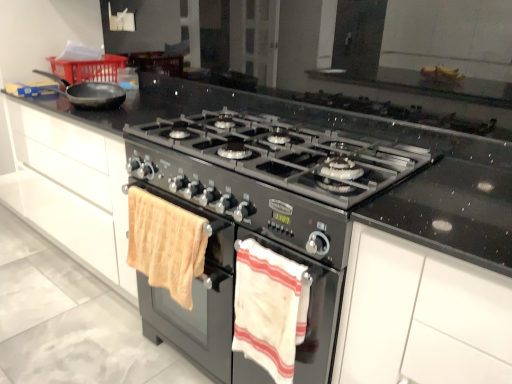
Measure the distance between point (337, 197) and camera.

Point (337, 197) is 3.30 feet from camera.

This screenshot has width=512, height=384. I want to click on black matte gas stove at center, so click(290, 154).

At what (x,y) coordinates should I click in order to perform the action: click on black matte gas stove at center. Please return your answer as a coordinate pair (x, y). Looking at the image, I should click on (290, 154).

Does beige cotton towel at lower left, positioned as the second beach towel in right-to-left order, contain white striped towel at lower center, the 2th beach towel when ordered from left to right?

No, beige cotton towel at lower left, positioned as the second beach towel in right-to-left order, does not contain white striped towel at lower center, the 2th beach towel when ordered from left to right.

Does beige cotton towel at lower left, marked as the 1th beach towel in a left-to-right arrangement, lie in front of white striped towel at lower center, the first beach towel when ordered from right to left?

No.

Can you confirm if beige cotton towel at lower left, positioned as the second beach towel in right-to-left order, is wider than white striped towel at lower center, the first beach towel when ordered from right to left?

Indeed, beige cotton towel at lower left, positioned as the second beach towel in right-to-left order, has a greater width compared to white striped towel at lower center, the first beach towel when ordered from right to left.

You are a GUI agent. You are given a task and a screenshot of the screen. Output one action in this format:
    pyautogui.click(x=<x>, y=<y>)
    Task: Click on the beach towel lying behind the white striped towel at lower center, the first beach towel when ordered from right to left
    
    Given the screenshot: What is the action you would take?
    pyautogui.click(x=165, y=244)

Which object is further away from the camera, black matte frying pan at upper left or white matte cabinet at upper right?

black matte frying pan at upper left is more distant.

Looking at their sizes, would you say black matte frying pan at upper left is wider or thinner than white matte cabinet at upper right?

In the image, black matte frying pan at upper left appears to be more narrow than white matte cabinet at upper right.

From the image's perspective, is black matte frying pan at upper left positioned above or below white matte cabinet at upper right?

From the image's perspective, black matte frying pan at upper left appears above white matte cabinet at upper right.

Identify the location of frying pan on the left of white matte cabinet at upper right. (90, 93).

Which is behind, point (101, 99) or point (290, 275)?

The point (101, 99) is more distant.

Is black matte frying pan at upper left in front of or behind white striped towel at lower center, the 2th beach towel when ordered from left to right, in the image?

Visually, black matte frying pan at upper left is located behind white striped towel at lower center, the 2th beach towel when ordered from left to right.

The width and height of the screenshot is (512, 384). What are the coordinates of `frying pan that is above the white striped towel at lower center, the 2th beach towel when ordered from left to right (from the image's perspective)` in the screenshot? It's located at (90, 93).

Is black matte frying pan at upper left turned away from white striped towel at lower center, the first beach towel when ordered from right to left?

No, black matte frying pan at upper left's orientation is not away from white striped towel at lower center, the first beach towel when ordered from right to left.

Considering the points (252, 293) and (361, 177), which point is behind, point (252, 293) or point (361, 177)?

The point (252, 293) is farther.

From a real-world perspective, which object rests below the other?

From a 3D spatial view, white striped towel at lower center, the first beach towel when ordered from right to left, is below.

Could you tell me if white striped towel at lower center, the first beach towel when ordered from right to left, is facing black matte gas stove at center?

No, white striped towel at lower center, the first beach towel when ordered from right to left, is not facing towards black matte gas stove at center.

Could you measure the distance between white striped towel at lower center, the first beach towel when ordered from right to left, and black matte gas stove at center?

white striped towel at lower center, the first beach towel when ordered from right to left, is 13.70 inches away from black matte gas stove at center.

Which object is further away from the camera, white matte cabinet at upper right or white striped towel at lower center, the 2th beach towel when ordered from left to right?

Positioned behind is white striped towel at lower center, the 2th beach towel when ordered from left to right.

How much distance is there between white matte cabinet at upper right and white striped towel at lower center, the first beach towel when ordered from right to left?

white matte cabinet at upper right and white striped towel at lower center, the first beach towel when ordered from right to left, are 24.63 centimeters apart from each other.

Is white matte cabinet at upper right directly adjacent to white striped towel at lower center, the first beach towel when ordered from right to left?

white matte cabinet at upper right and white striped towel at lower center, the first beach towel when ordered from right to left, are clearly separated.

Is white matte cabinet at upper right taller or shorter than white striped towel at lower center, the 2th beach towel when ordered from left to right?

Clearly, white matte cabinet at upper right is taller compared to white striped towel at lower center, the 2th beach towel when ordered from left to right.

Which is behind, point (477, 372) or point (362, 185)?

The point (362, 185) is more distant.

Which object is thinner, white matte cabinet at upper right or black matte gas stove at center?

Thinner between the two is white matte cabinet at upper right.

From the image's perspective, is white matte cabinet at upper right over black matte gas stove at center?

No, from the image's perspective, white matte cabinet at upper right is not above black matte gas stove at center.

Considering the sizes of objects white matte cabinet at upper right and black matte gas stove at center in the image provided, who is bigger, white matte cabinet at upper right or black matte gas stove at center?

With larger size is white matte cabinet at upper right.

Looking at this image, can you confirm if white matte cabinet at upper right is taller than beige cotton towel at lower left, marked as the 1th beach towel in a left-to-right arrangement?

Correct, white matte cabinet at upper right is much taller as beige cotton towel at lower left, marked as the 1th beach towel in a left-to-right arrangement.

Would you say white matte cabinet at upper right is outside beige cotton towel at lower left, marked as the 1th beach towel in a left-to-right arrangement?

white matte cabinet at upper right lies outside beige cotton towel at lower left, marked as the 1th beach towel in a left-to-right arrangement,'s area.

Does white matte cabinet at upper right lie in front of beige cotton towel at lower left, positioned as the second beach towel in right-to-left order?

Yes, it is.

In the scene shown: Is white matte cabinet at upper right turned away from beige cotton towel at lower left, positioned as the second beach towel in right-to-left order?

That's not correct — white matte cabinet at upper right is not looking away from beige cotton towel at lower left, positioned as the second beach towel in right-to-left order.

At what (x,y) coordinates should I click in order to perform the action: click on beach towel below the beige cotton towel at lower left, marked as the 1th beach towel in a left-to-right arrangement (from the image's perspective). Please return your answer as a coordinate pair (x, y). The width and height of the screenshot is (512, 384). Looking at the image, I should click on (267, 308).

This screenshot has width=512, height=384. Identify the location of frying pan above the white matte cabinet at upper right (from the image's perspective). (90, 93).

Consider the image. Considering their positions, is black matte frying pan at upper left positioned further to white matte cabinet at upper right than white striped towel at lower center, the 2th beach towel when ordered from left to right?

Among the two, black matte frying pan at upper left is located further to white matte cabinet at upper right.

From the picture: From the image, which object appears to be farther from white matte cabinet at upper right, white striped towel at lower center, the first beach towel when ordered from right to left, or black matte frying pan at upper left?

Among the two, black matte frying pan at upper left is located further to white matte cabinet at upper right.

Estimate the real-world distances between objects in this image. Which object is further from black matte gas stove at center, beige cotton towel at lower left, positioned as the second beach towel in right-to-left order, or white matte cabinet at upper right?

The object further to black matte gas stove at center is white matte cabinet at upper right.

When comparing their distances from black matte frying pan at upper left, does white matte cabinet at upper right or black matte gas stove at center seem further?

The object further to black matte frying pan at upper left is white matte cabinet at upper right.

Consider the image. Estimate the real-world distances between objects in this image. Which object is closer to beige cotton towel at lower left, marked as the 1th beach towel in a left-to-right arrangement, white striped towel at lower center, the 2th beach towel when ordered from left to right, or black matte frying pan at upper left?

white striped towel at lower center, the 2th beach towel when ordered from left to right, is closer to beige cotton towel at lower left, marked as the 1th beach towel in a left-to-right arrangement.

Estimate the real-world distances between objects in this image. Which object is closer to beige cotton towel at lower left, positioned as the second beach towel in right-to-left order, black matte gas stove at center or black matte frying pan at upper left?

Among the two, black matte gas stove at center is located nearer to beige cotton towel at lower left, positioned as the second beach towel in right-to-left order.

Looking at the image, which one is located closer to black matte gas stove at center, white striped towel at lower center, the first beach towel when ordered from right to left, or beige cotton towel at lower left, positioned as the second beach towel in right-to-left order?

beige cotton towel at lower left, positioned as the second beach towel in right-to-left order, is positioned closer to the anchor black matte gas stove at center.

Which object lies further to the anchor point black matte gas stove at center, white striped towel at lower center, the first beach towel when ordered from right to left, or black matte frying pan at upper left?

black matte frying pan at upper left lies further to black matte gas stove at center than the other object.

This screenshot has width=512, height=384. In order to click on gas stove located between beige cotton towel at lower left, positioned as the second beach towel in right-to-left order, and white matte cabinet at upper right in the left-right direction in this screenshot , I will do `click(290, 154)`.

Find the location of a particular element. The height and width of the screenshot is (384, 512). gas stove between black matte frying pan at upper left and white matte cabinet at upper right in the horizontal direction is located at coordinates (290, 154).

At what (x,y) coordinates should I click in order to perform the action: click on beach towel between black matte frying pan at upper left and white striped towel at lower center, the first beach towel when ordered from right to left, from top to bottom. Please return your answer as a coordinate pair (x, y). This screenshot has width=512, height=384. Looking at the image, I should click on (165, 244).

Find the location of `beach towel that lies between black matte gas stove at center and white striped towel at lower center, the first beach towel when ordered from right to left, from top to bottom`. beach towel that lies between black matte gas stove at center and white striped towel at lower center, the first beach towel when ordered from right to left, from top to bottom is located at coordinates (165, 244).